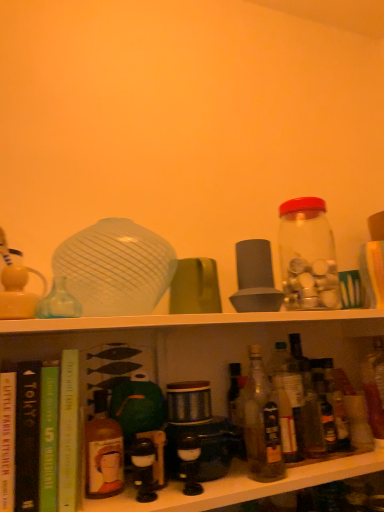
Question: Is translucent glass bottle at center, acting as the third bottle starting from the right, facing towards hardcover book at center, the first book in the right-to-left sequence?

Choices:
 (A) yes
 (B) no

Answer: (B)

Question: Does translucent glass bottle at center, the 3th bottle viewed from the left, have a larger size compared to hardcover book at center, acting as the fourth book starting from the left?

Choices:
 (A) yes
 (B) no

Answer: (B)

Question: Is translucent glass bottle at center, the 3th bottle viewed from the left, looking in the opposite direction of hardcover book at center, the first book in the right-to-left sequence?

Choices:
 (A) yes
 (B) no

Answer: (B)

Question: Is translucent glass bottle at center, the 3th bottle viewed from the left, smaller than hardcover book at center, acting as the fourth book starting from the left?

Choices:
 (A) no
 (B) yes

Answer: (B)

Question: From the image's perspective, does translucent glass bottle at center, acting as the third bottle starting from the right, appear higher than hardcover book at center, the first book in the right-to-left sequence?

Choices:
 (A) no
 (B) yes

Answer: (B)

Question: Is point (51, 449) positioned closer to the camera than point (23, 497)?

Choices:
 (A) closer
 (B) farther

Answer: (B)

Question: From the image's perspective, relative to black matte book at left, the 2th book in the left-to-right sequence, is green matte book at lower left, arranged as the third book when viewed from the left, above or below?

Choices:
 (A) above
 (B) below

Answer: (B)

Question: Considering the positions of green matte book at lower left, arranged as the third book when viewed from the left, and black matte book at left, positioned as the third book in right-to-left order, in the image, is green matte book at lower left, arranged as the third book when viewed from the left, wider or thinner than black matte book at left, positioned as the third book in right-to-left order,?

Choices:
 (A) wide
 (B) thin

Answer: (B)

Question: In the image, is green matte book at lower left, arranged as the third book when viewed from the left, positioned in front of or behind black matte book at left, the 2th book in the left-to-right sequence?

Choices:
 (A) front
 (B) behind

Answer: (B)

Question: Visually, is transparent glass jar at upper right, the first bottle when ordered from right to left, positioned to the left or to the right of translucent glass vase at upper center, the first tableware from the left?

Choices:
 (A) left
 (B) right

Answer: (B)

Question: Considering their positions, is transparent glass jar at upper right, the first bottle when ordered from right to left, located in front of or behind translucent glass vase at upper center, the first tableware from the left?

Choices:
 (A) behind
 (B) front

Answer: (A)

Question: From the image's perspective, relative to translucent glass vase at upper center, the second tableware when ordered from right to left, is transparent glass jar at upper right, the first bottle when ordered from right to left, above or below?

Choices:
 (A) below
 (B) above

Answer: (B)

Question: Is point (294, 217) closer or farther from the camera than point (84, 280)?

Choices:
 (A) closer
 (B) farther

Answer: (B)

Question: Looking at the image, does transparent glass jar at upper right, the first bottle when ordered from right to left, seem bigger or smaller compared to green matte mug at center, the first tableware viewed from the right?

Choices:
 (A) big
 (B) small

Answer: (A)

Question: In terms of width, does transparent glass jar at upper right, the fifth bottle from the left, look wider or thinner when compared to green matte mug at center, the first tableware viewed from the right?

Choices:
 (A) thin
 (B) wide

Answer: (B)